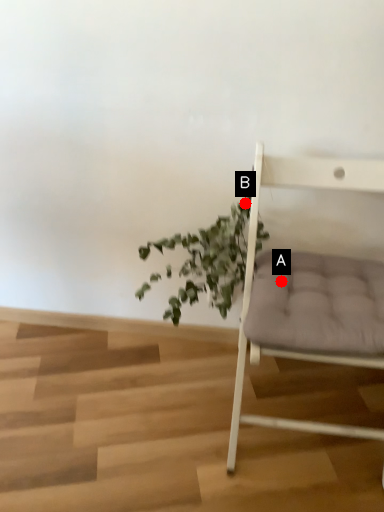
Question: Two points are circled on the image, labeled by A and B beside each circle. Which point appears farthest from the camera in this image?

Choices:
 (A) A is further
 (B) B is further

Answer: (B)